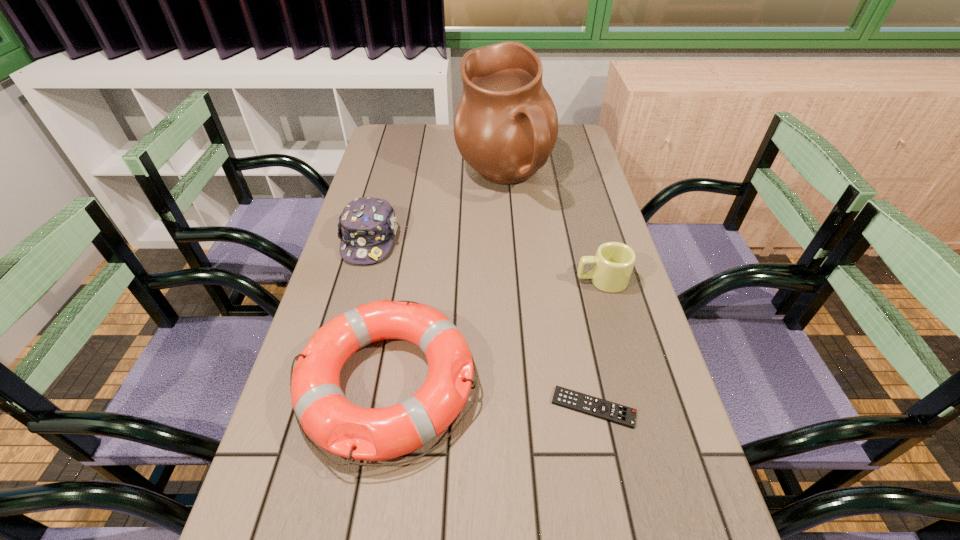
Locate an element on the screen. The height and width of the screenshot is (540, 960). object located in the far right corner section of the desktop is located at coordinates (506, 125).

Image resolution: width=960 pixels, height=540 pixels. What are the coordinates of `vacant space at the far edge of the desktop` in the screenshot? It's located at (454, 143).

In the image, there is a desktop. At what (x,y) coordinates should I click in order to perform the action: click on vacant region at the left edge. Please return your answer as a coordinate pair (x, y). The height and width of the screenshot is (540, 960). Looking at the image, I should click on (388, 173).

Where is `vacant area at the right edge of the desktop`? Image resolution: width=960 pixels, height=540 pixels. vacant area at the right edge of the desktop is located at coordinates (571, 163).

At what (x,y) coordinates should I click in order to perform the action: click on free space at the far left corner of the desktop. Please return your answer as a coordinate pair (x, y). Image resolution: width=960 pixels, height=540 pixels. Looking at the image, I should click on (396, 134).

The image size is (960, 540). Identify the location of unoccupied position between the life buoy and the shortest object. pyautogui.click(x=490, y=395).

Find the location of a particular element. Image resolution: width=960 pixels, height=540 pixels. vacant region between the third nearest object and the shortest object is located at coordinates (597, 344).

Where is `vacant space in between the third nearest object and the shortest object`? The height and width of the screenshot is (540, 960). vacant space in between the third nearest object and the shortest object is located at coordinates (597, 344).

Identify the location of free area in between the cream pitcher and the shortest object. Image resolution: width=960 pixels, height=540 pixels. (549, 293).

Where is `blank region between the mug and the remote control`? Image resolution: width=960 pixels, height=540 pixels. blank region between the mug and the remote control is located at coordinates (597, 344).